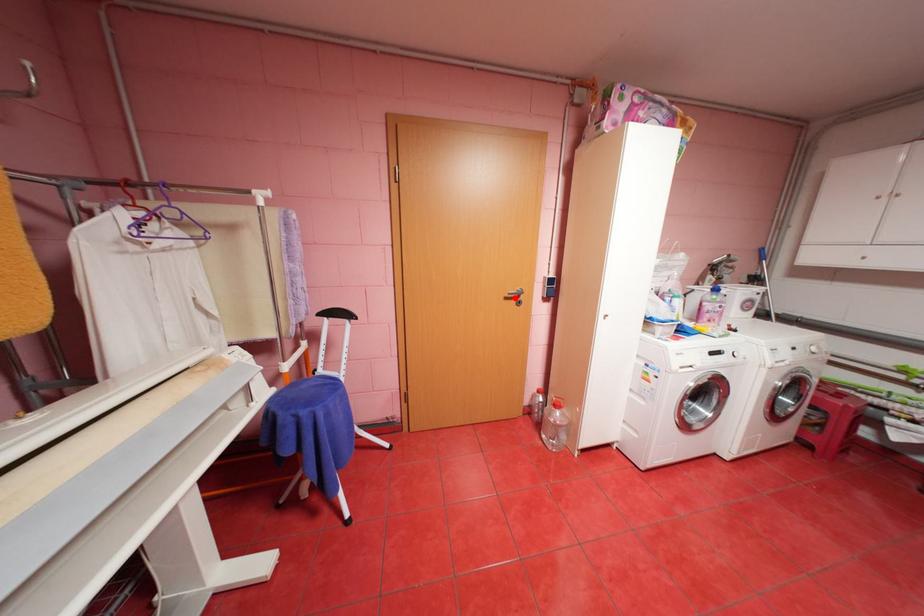
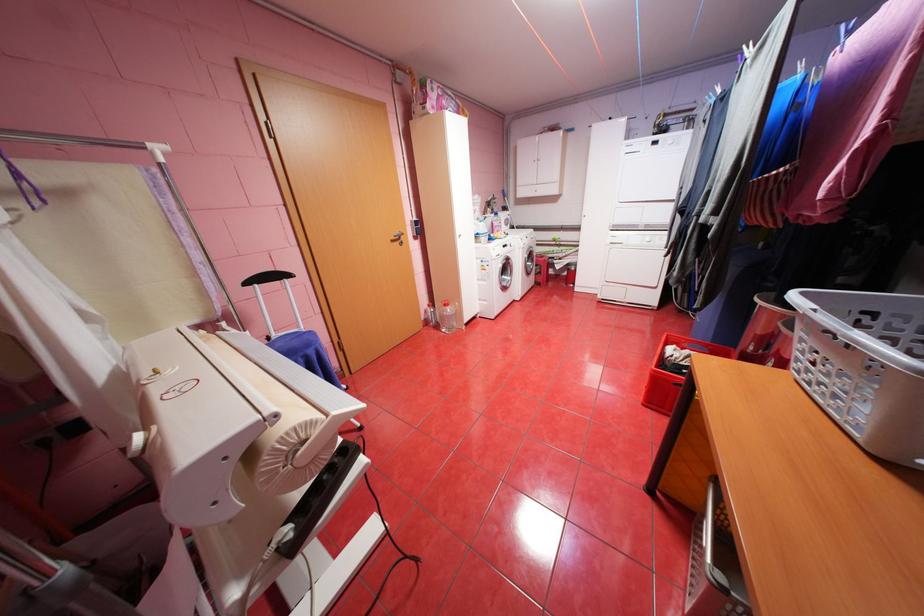
The point at the highlighted location is marked in the first image. Where is the corresponding point in the second image?

(400, 241)